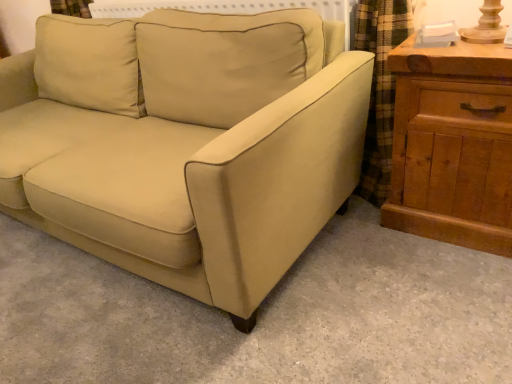
Question: Could you tell me if wooden chest of drawers at right is facing beige fabric couch at center?

Choices:
 (A) yes
 (B) no

Answer: (B)

Question: Is wooden chest of drawers at right thinner than beige fabric couch at center?

Choices:
 (A) yes
 (B) no

Answer: (A)

Question: Is wooden chest of drawers at right further to camera compared to beige fabric couch at center?

Choices:
 (A) no
 (B) yes

Answer: (B)

Question: Are wooden chest of drawers at right and beige fabric couch at center far apart?

Choices:
 (A) yes
 (B) no

Answer: (B)

Question: From a real-world perspective, does wooden chest of drawers at right stand above beige fabric couch at center?

Choices:
 (A) yes
 (B) no

Answer: (B)

Question: From the image's perspective, is wooden chest of drawers at right located beneath beige fabric couch at center?

Choices:
 (A) no
 (B) yes

Answer: (B)

Question: Is the depth of beige fabric couch at center greater than that of wooden chest of drawers at right?

Choices:
 (A) yes
 (B) no

Answer: (B)

Question: Considering the relative positions of beige fabric couch at center and wooden chest of drawers at right in the image provided, is beige fabric couch at center to the left of wooden chest of drawers at right from the viewer's perspective?

Choices:
 (A) yes
 (B) no

Answer: (A)

Question: Does beige fabric couch at center have a larger size compared to wooden chest of drawers at right?

Choices:
 (A) yes
 (B) no

Answer: (A)

Question: Does beige fabric couch at center lie in front of wooden chest of drawers at right?

Choices:
 (A) yes
 (B) no

Answer: (A)

Question: Is beige fabric couch at center turned away from wooden chest of drawers at right?

Choices:
 (A) yes
 (B) no

Answer: (B)

Question: Is beige fabric couch at center next to wooden chest of drawers at right?

Choices:
 (A) no
 (B) yes

Answer: (A)

Question: Looking at the image, does wooden chest of drawers at right seem bigger or smaller compared to beige fabric couch at center?

Choices:
 (A) big
 (B) small

Answer: (B)